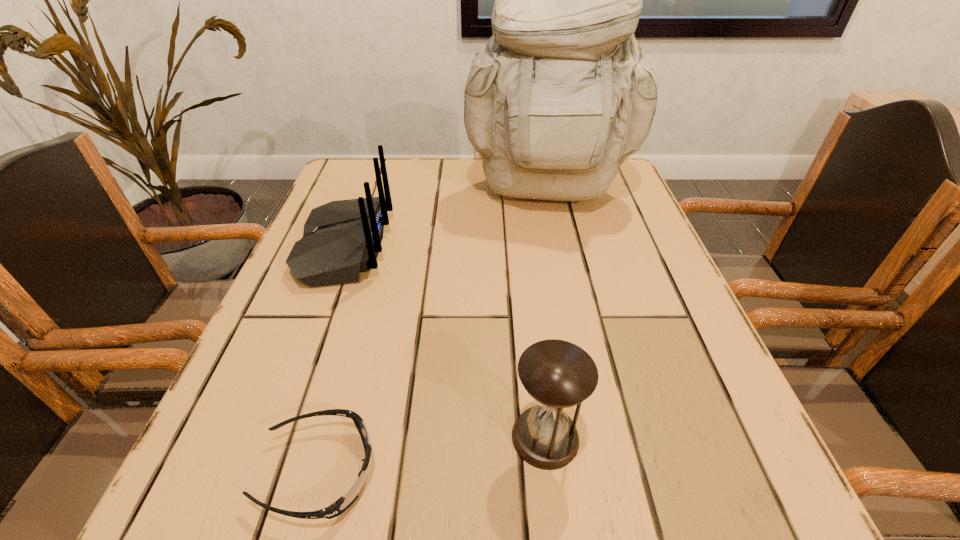
Identify the location of free space between the shortest object and the second shortest object. (432, 454).

Locate an element on the screen. The width and height of the screenshot is (960, 540). free spot between the second tallest object and the sunglasses is located at coordinates (x=332, y=359).

Choose which object is the nearest neighbor to the tallest object. Please provide its 2D coordinates. Your answer should be formatted as a tuple, i.e. [(x, y)], where the tuple contains the x and y coordinates of a point satisfying the conditions above.

[(341, 239)]

Identify which object is the third nearest to the router. Please provide its 2D coordinates. Your answer should be formatted as a tuple, i.e. [(x, y)], where the tuple contains the x and y coordinates of a point satisfying the conditions above.

[(558, 374)]

You are a GUI agent. You are given a task and a screenshot of the screen. Output one action in this format:
    pyautogui.click(x=<x>, y=<y>)
    Task: Click on the free region that satisfies the following two spatial constraints: 1. on the back side of the second shortest object; 2. on the back of the router
    This screenshot has width=960, height=540.
    Given the screenshot: What is the action you would take?
    pyautogui.click(x=523, y=247)

At what (x,y) coordinates should I click in order to perform the action: click on free location that satisfies the following two spatial constraints: 1. on the back of the second shortest object; 2. on the left side of the router. Please return your answer as a coordinate pair (x, y). Image resolution: width=960 pixels, height=540 pixels. Looking at the image, I should click on [275, 437].

At what (x,y) coordinates should I click in order to perform the action: click on free space in the image that satisfies the following two spatial constraints: 1. on the front-facing side of the tallest object; 2. on the lenses of the sunglasses. Please return your answer as a coordinate pair (x, y). This screenshot has height=540, width=960. Looking at the image, I should click on (607, 471).

Locate an element on the screen. This screenshot has height=540, width=960. vacant space that satisfies the following two spatial constraints: 1. on the front-facing side of the backpack; 2. on the back of the third shortest object is located at coordinates (559, 247).

I want to click on free region that satisfies the following two spatial constraints: 1. on the back of the second tallest object; 2. on the back side of the hourglass, so click(275, 437).

Identify the location of vacant point that satisfies the following two spatial constraints: 1. on the front-facing side of the tallest object; 2. on the back of the third shortest object. (559, 247).